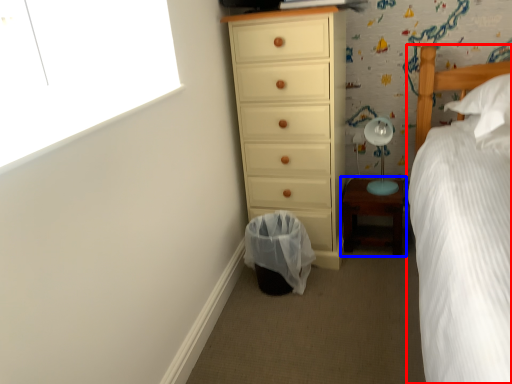
Question: Which point is further to the camera, bed (highlighted by a red box) or nightstand (highlighted by a blue box)?

Choices:
 (A) bed
 (B) nightstand

Answer: (B)